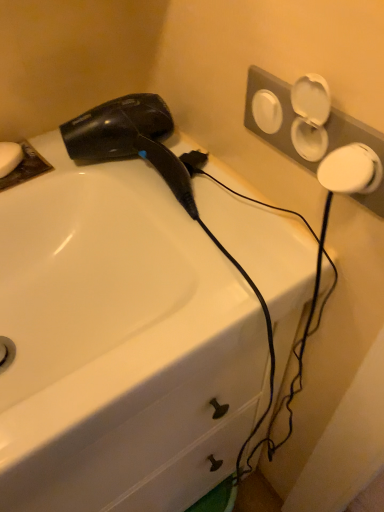
Locate an element on the screen. empty space that is to the right of white matte soap at upper left is located at coordinates (97, 173).